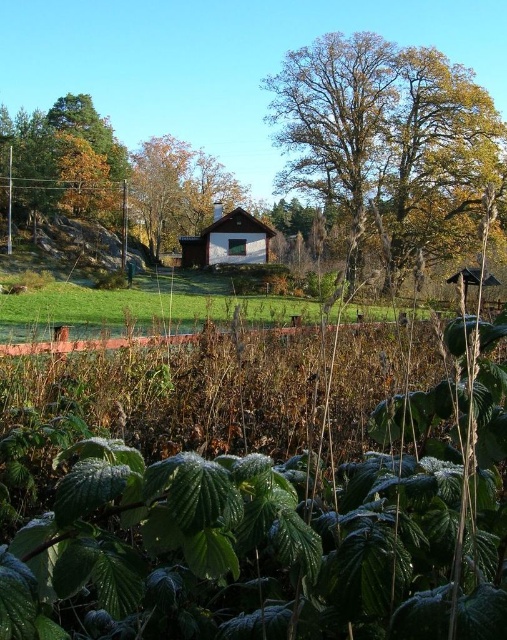
Question: Among these points, which one is nearest to the camera?

Choices:
 (A) (479, 184)
 (B) (378, 307)
 (C) (58, 113)
 (D) (247, 243)

Answer: (B)

Question: Estimate the real-world distances between objects in this image. Which object is farther from the golden-brown textured tree at upper right?

Choices:
 (A) brown wooden hut at center
 (B) brown wood house at center

Answer: (B)

Question: Which point is farther to the camera?

Choices:
 (A) brown wooden hut at center
 (B) golden-brown textured tree at upper right
 (C) green grass at center

Answer: (A)

Question: In this image, where is green grass at center located relative to brown wooden hut at center?

Choices:
 (A) above
 (B) below

Answer: (B)

Question: Where is golden-brown textured tree at upper right located in relation to brown wooden hut at center in the image?

Choices:
 (A) right
 (B) left

Answer: (A)

Question: Is golden-brown textured tree at upper right behind green grass at center?

Choices:
 (A) yes
 (B) no

Answer: (A)